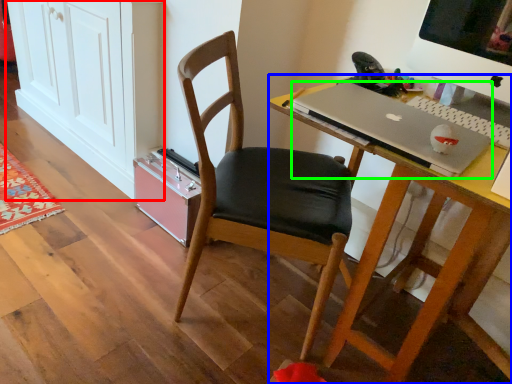
Question: Which object is positioned closest to cabinetry (highlighted by a red box)? Select from desk (highlighted by a blue box) and laptop (highlighted by a green box).

Choices:
 (A) desk
 (B) laptop

Answer: (B)